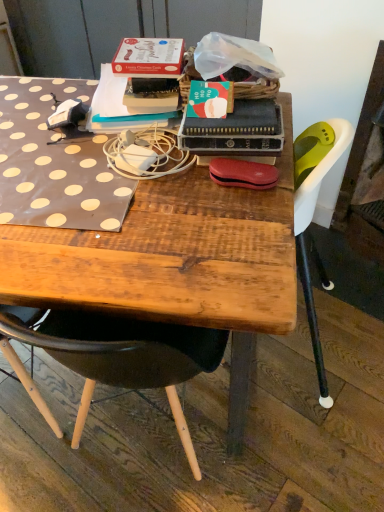
This screenshot has width=384, height=512. I want to click on vacant region in front of matte red pouch at center, so click(x=233, y=223).